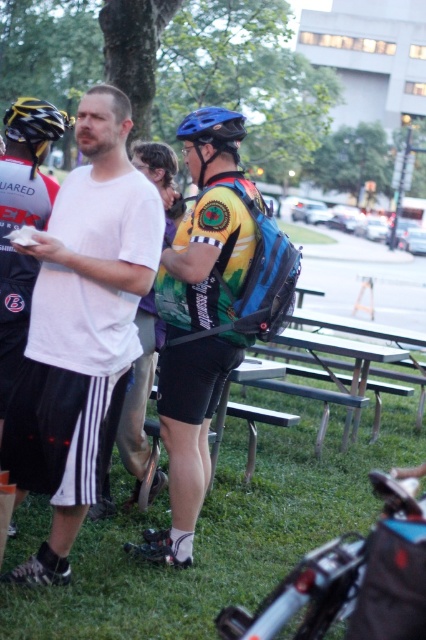
Question: Is the position of metallic silver bicycle at lower center less distant than that of blue matte bicycle helmet at upper center?

Choices:
 (A) yes
 (B) no

Answer: (A)

Question: Which point is closer to the camera?

Choices:
 (A) white matte t-shirt at left
 (B) blue matte bicycle helmet at upper center

Answer: (A)

Question: Is matte yellow jersey at center bigger than metallic silver bicycle at lower center?

Choices:
 (A) yes
 (B) no

Answer: (A)

Question: Among these points, which one is farthest from the camera?

Choices:
 (A) (268, 636)
 (B) (198, 118)
 (C) (37, 116)

Answer: (B)

Question: Which of the following is the farthest from the observer?

Choices:
 (A) metallic silver bicycle at lower center
 (B) blue matte bicycle helmet at center

Answer: (B)

Question: Observing the image, what is the correct spatial positioning of matte yellow jersey at center in reference to blue matte bicycle helmet at center?

Choices:
 (A) above
 (B) below

Answer: (B)